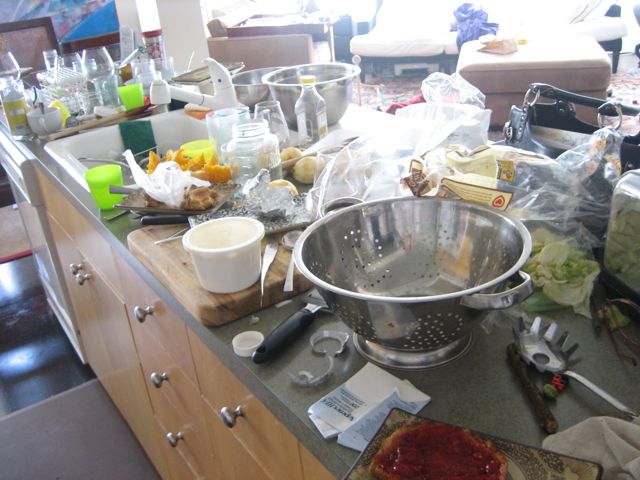
This screenshot has height=480, width=640. I want to click on kitchen handtool, so click(541, 345), click(312, 307), click(159, 216), click(278, 223).